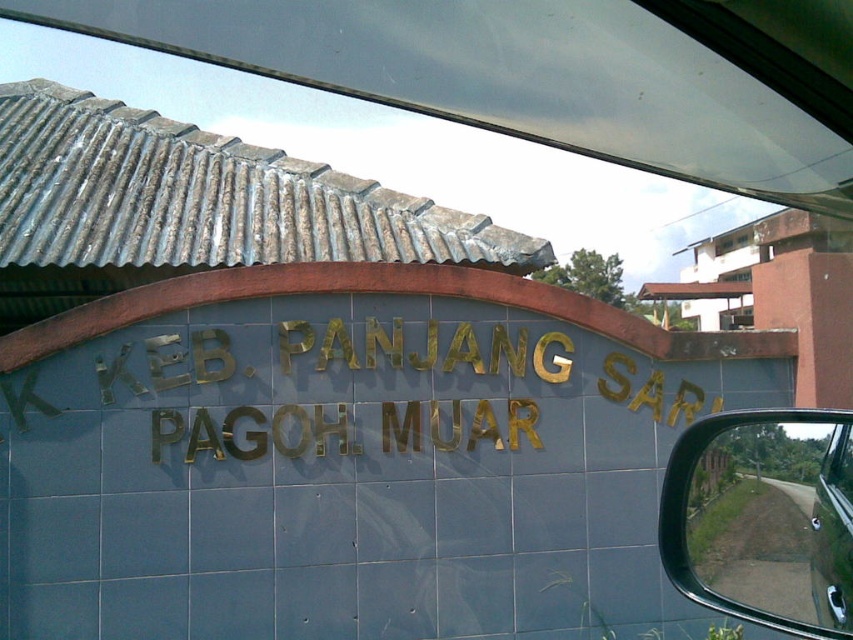
Question: Does gold metallic sign at center appear on the right side of glossy metallic side mirror at lower right?

Choices:
 (A) no
 (B) yes

Answer: (A)

Question: Among these points, which one is farthest from the camera?

Choices:
 (A) (428, 348)
 (B) (689, 474)

Answer: (A)

Question: Does gold metallic sign at center appear on the left side of glossy metallic side mirror at lower right?

Choices:
 (A) yes
 (B) no

Answer: (A)

Question: Which of the following is the farthest from the observer?

Choices:
 (A) (691, 531)
 (B) (22, 397)

Answer: (B)

Question: Does gold metallic sign at center have a lesser width compared to glossy metallic side mirror at lower right?

Choices:
 (A) no
 (B) yes

Answer: (A)